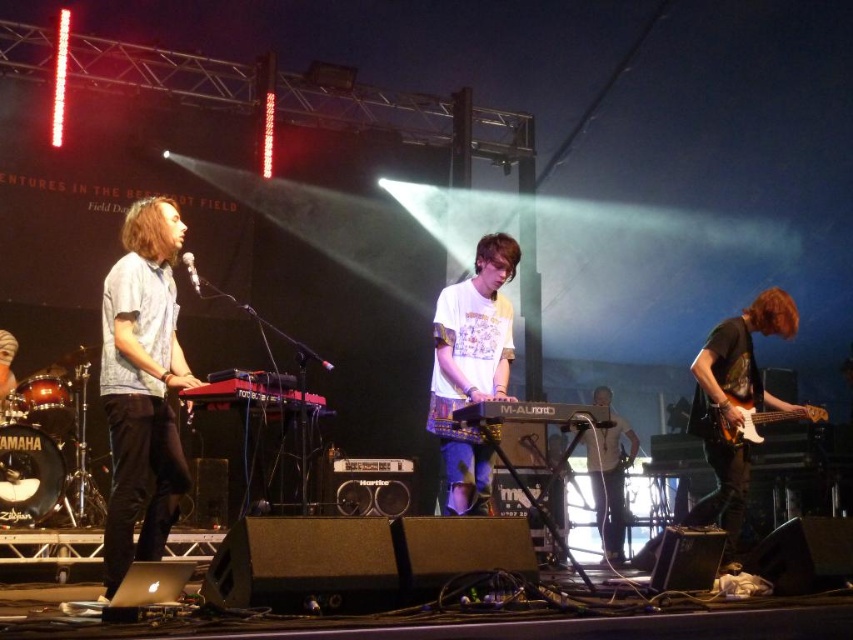
Can you confirm if matte light blue shirt at left is wider than white matte shirt at center?

No.

What do you see at coordinates (142, 387) in the screenshot?
I see `matte light blue shirt at left` at bounding box center [142, 387].

Does point (161, 360) lie in front of point (602, 428)?

Yes, point (161, 360) is in front of point (602, 428).

Where is `matte light blue shirt at left`? The height and width of the screenshot is (640, 853). matte light blue shirt at left is located at coordinates (142, 387).

Can you confirm if matte light blue shirt at left is positioned above white glossy electric guitar at right?

Correct, matte light blue shirt at left is located above white glossy electric guitar at right.

Does matte light blue shirt at left have a lesser height compared to white glossy electric guitar at right?

Incorrect, matte light blue shirt at left's height does not fall short of white glossy electric guitar at right's.

Measure the distance between matte light blue shirt at left and camera.

matte light blue shirt at left is 3.80 meters from camera.

At what (x,y) coordinates should I click in order to perform the action: click on matte light blue shirt at left. Please return your answer as a coordinate pair (x, y). Looking at the image, I should click on (142, 387).

Does white cotton t-shirt at center have a smaller size compared to dark green textured t-shirt at right?

Indeed, white cotton t-shirt at center has a smaller size compared to dark green textured t-shirt at right.

Who is positioned more to the right, white cotton t-shirt at center or dark green textured t-shirt at right?

dark green textured t-shirt at right is more to the right.

Which is in front, point (469, 387) or point (784, 300)?

Point (469, 387) is in front.

Where is `white cotton t-shirt at center`? white cotton t-shirt at center is located at coordinates click(473, 365).